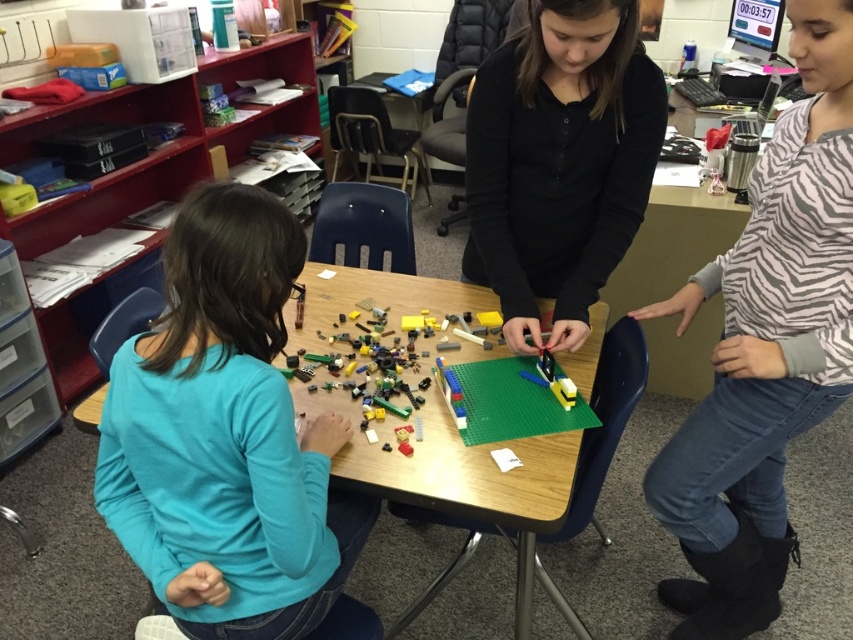
Between zebra-patterned sweater at upper right and black matte shirt at center, which one appears on the right side from the viewer's perspective?

zebra-patterned sweater at upper right

What do you see at coordinates (764, 348) in the screenshot? I see `zebra-patterned sweater at upper right` at bounding box center [764, 348].

The height and width of the screenshot is (640, 853). I want to click on zebra-patterned sweater at upper right, so click(x=764, y=348).

Is teal fabric shirt at lower left further to the viewer compared to black matte shirt at center?

No, teal fabric shirt at lower left is closer to the viewer.

Does teal fabric shirt at lower left have a lesser width compared to black matte shirt at center?

Incorrect, teal fabric shirt at lower left's width is not less than black matte shirt at center's.

Which is behind, point (236, 195) or point (576, 344)?

The point (576, 344) is more distant.

Where is `teal fabric shirt at lower left`? The width and height of the screenshot is (853, 640). teal fabric shirt at lower left is located at coordinates click(x=225, y=436).

Is zebra-patterned sweater at upper right behind wooden table at center?

No, it is not.

Who is taller, zebra-patterned sweater at upper right or wooden table at center?

Standing taller between the two is zebra-patterned sweater at upper right.

Between point (787, 326) and point (456, 448), which one is positioned in front?

Point (787, 326) is more forward.

You are a GUI agent. You are given a task and a screenshot of the screen. Output one action in this format:
    pyautogui.click(x=<x>, y=<y>)
    Task: Click on the zebra-patterned sweater at upper right
    The image size is (853, 640).
    Given the screenshot: What is the action you would take?
    pyautogui.click(x=764, y=348)